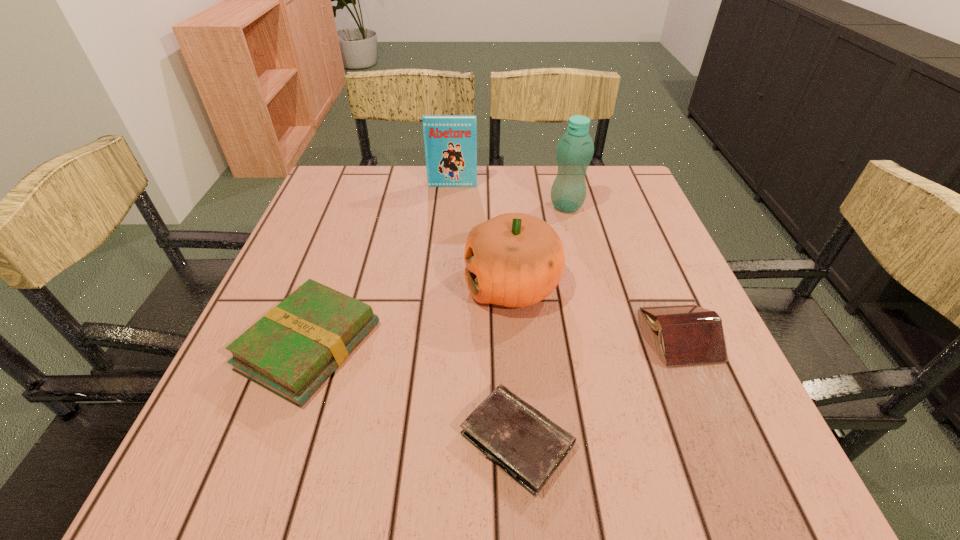
The width and height of the screenshot is (960, 540). Identify the location of vacant space situated 0.180m at the front cap of the water bottle. (481, 206).

This screenshot has height=540, width=960. I want to click on free location located 0.370m on the front cover of the farthest object, so click(x=444, y=278).

I want to click on free space located 0.100m on the face of the fourth shortest object, so click(419, 285).

This screenshot has height=540, width=960. What are the coordinates of `vacant space located on the face of the fourth shortest object` in the screenshot? It's located at (338, 285).

The height and width of the screenshot is (540, 960). In order to click on free location located on the face of the fourth shortest object in this screenshot , I will do `click(348, 285)`.

The image size is (960, 540). In order to click on blank area located on the right of the leftmost object in this screenshot , I will do `click(429, 346)`.

Where is `blank area located on the back of the rightmost book`? The width and height of the screenshot is (960, 540). blank area located on the back of the rightmost book is located at coordinates (656, 275).

The height and width of the screenshot is (540, 960). I want to click on free space located 0.330m on the left of the shortest object, so click(x=248, y=440).

The width and height of the screenshot is (960, 540). Identify the location of water bottle located at the far edge. (575, 149).

You are a GUI agent. You are given a task and a screenshot of the screen. Output one action in this format:
    pyautogui.click(x=<x>, y=<y>)
    Task: Click on the book that is positioned at the far edge
    The width and height of the screenshot is (960, 540).
    Given the screenshot: What is the action you would take?
    pyautogui.click(x=450, y=141)